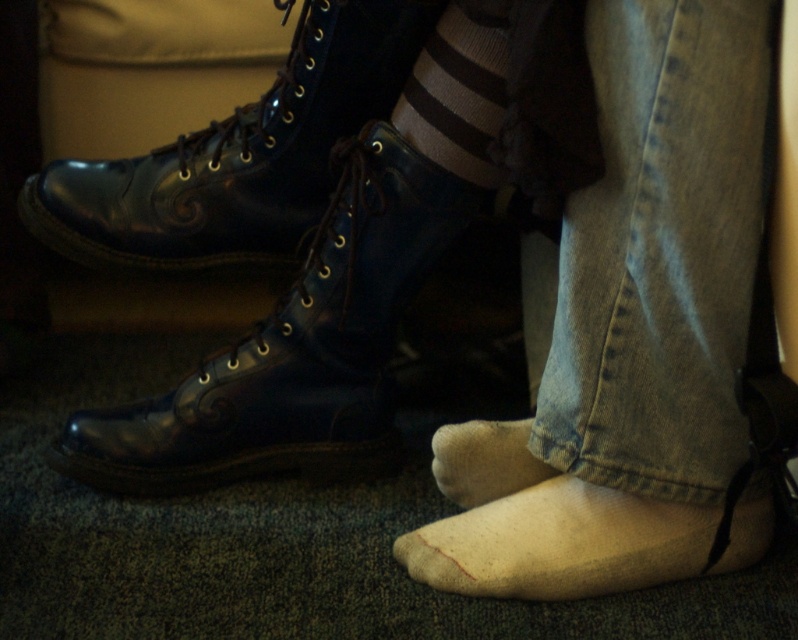
Image resolution: width=798 pixels, height=640 pixels. What do you see at coordinates (239, 154) in the screenshot?
I see `black leather boot at center` at bounding box center [239, 154].

Between point (287, 154) and point (441, 83), which one is positioned in front?

Positioned in front is point (441, 83).

This screenshot has width=798, height=640. I want to click on black leather boot at center, so click(x=239, y=154).

Which is more to the left, white cotton sock at lower center or white fluffy sock at lower center?

Positioned to the left is white fluffy sock at lower center.

Who is higher up, white cotton sock at lower center or white fluffy sock at lower center?

white fluffy sock at lower center

Which is in front, point (528, 513) or point (447, 435)?

Point (528, 513) is more forward.

Identify the location of white cotton sock at lower center. (559, 544).

The width and height of the screenshot is (798, 640). What do you see at coordinates (658, 252) in the screenshot?
I see `denim at right` at bounding box center [658, 252].

Is point (717, 372) behind point (368, 243)?

No, (717, 372) is in front of (368, 243).

Is point (674, 304) positioned in front of point (320, 301)?

Yes, it is in front of point (320, 301).

Identify the location of denim at right. The height and width of the screenshot is (640, 798). (658, 252).